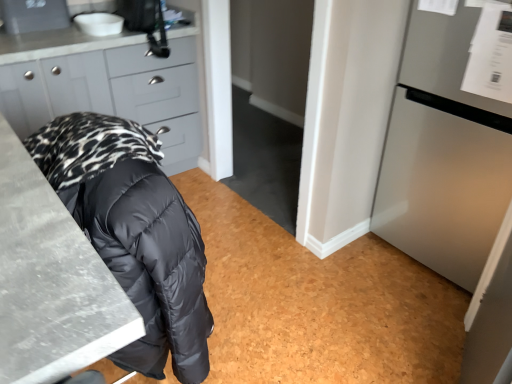
In order to face matte gray cabinets at upper left, should I rotate leftwards or rightwards?

To align with it, rotate left about 20.177°.

At what (x,y) coordinates should I click in order to perform the action: click on white glossy sink at upper left. Please return your answer as a coordinate pair (x, y). Image resolution: width=512 pixels, height=384 pixels. Looking at the image, I should click on (99, 23).

Image resolution: width=512 pixels, height=384 pixels. What do you see at coordinates (99, 23) in the screenshot?
I see `white glossy sink at upper left` at bounding box center [99, 23].

Identify the location of matte gray cabinets at upper left. (112, 93).

Could you tell me if white glossy sink at upper left is turned towards satin silver refrigerator at right?

No, white glossy sink at upper left is not turned towards satin silver refrigerator at right.

In the scene shown: Is the surface of white glossy sink at upper left in direct contact with satin silver refrigerator at right?

No, white glossy sink at upper left is not next to satin silver refrigerator at right.

Which is correct: white glossy sink at upper left is inside satin silver refrigerator at right, or outside of it?

white glossy sink at upper left is not inside satin silver refrigerator at right, it's outside.

Which object is positioned more to the right, white glossy sink at upper left or marble gray countertop at lower left?

Positioned to the right is marble gray countertop at lower left.

Which of these two, white glossy sink at upper left or marble gray countertop at lower left, stands taller?

marble gray countertop at lower left is taller.

Is point (86, 26) closer to camera compared to point (6, 371)?

That is False.

The width and height of the screenshot is (512, 384). I want to click on countertop lying on the right of white glossy sink at upper left, so click(51, 281).

Who is smaller, satin silver refrigerator at right or matte gray cabinets at upper left?

With smaller size is satin silver refrigerator at right.

Is satin silver refrigerator at right surrounding matte gray cabinets at upper left?

No, satin silver refrigerator at right does not contain matte gray cabinets at upper left.

Is satin silver refrigerator at right facing away from matte gray cabinets at upper left?

No.

Does satin silver refrigerator at right have a lesser height compared to matte gray cabinets at upper left?

No.

Is white glossy sink at upper left looking in the opposite direction of matte gray cabinets at upper left?

No, white glossy sink at upper left's orientation is not away from matte gray cabinets at upper left.

In the image, is white glossy sink at upper left positioned in front of or behind matte gray cabinets at upper left?

white glossy sink at upper left is positioned farther from the viewer than matte gray cabinets at upper left.

Based on their positions, is white glossy sink at upper left located to the left or right of matte gray cabinets at upper left?

white glossy sink at upper left is positioned on matte gray cabinets at upper left's right side.

Is point (180, 135) closer or farther from the camera than point (42, 283)?

Point (180, 135) is farther from the camera than point (42, 283).

Considering the relative sizes of matte gray cabinets at upper left and marble gray countertop at lower left in the image provided, is matte gray cabinets at upper left taller than marble gray countertop at lower left?

No, matte gray cabinets at upper left is not taller than marble gray countertop at lower left.

What's the angular difference between matte gray cabinets at upper left and marble gray countertop at lower left's facing directions?

There is a 88.6-degree angle between the facing directions of matte gray cabinets at upper left and marble gray countertop at lower left.

Considering the sizes of objects matte gray cabinets at upper left and marble gray countertop at lower left in the image provided, who is smaller, matte gray cabinets at upper left or marble gray countertop at lower left?

marble gray countertop at lower left is smaller.

In the image, is satin silver refrigerator at right positioned in front of or behind marble gray countertop at lower left?

Clearly, satin silver refrigerator at right is behind marble gray countertop at lower left.

Is satin silver refrigerator at right positioned far away from marble gray countertop at lower left?

satin silver refrigerator at right is far away from marble gray countertop at lower left.

Considering the positions of objects satin silver refrigerator at right and marble gray countertop at lower left in the image provided, who is more to the right, satin silver refrigerator at right or marble gray countertop at lower left?

satin silver refrigerator at right is more to the right.

From a real-world perspective, is satin silver refrigerator at right positioned above or below marble gray countertop at lower left?

satin silver refrigerator at right is above marble gray countertop at lower left.

From a real-world perspective, which is physically below, matte gray cabinets at upper left or white glossy sink at upper left?

matte gray cabinets at upper left is physically lower.

Is matte gray cabinets at upper left looking in the opposite direction of white glossy sink at upper left?

matte gray cabinets at upper left is not turned away from white glossy sink at upper left.

Consider the image. Considering the relative sizes of matte gray cabinets at upper left and white glossy sink at upper left in the image provided, is matte gray cabinets at upper left thinner than white glossy sink at upper left?

In fact, matte gray cabinets at upper left might be wider than white glossy sink at upper left.

Does matte gray cabinets at upper left appear on the left side of white glossy sink at upper left?

Yes.

I want to click on sink above the satin silver refrigerator at right (from a real-world perspective), so click(99, 23).

The image size is (512, 384). Find the location of `sink on the left of marble gray countertop at lower left`. sink on the left of marble gray countertop at lower left is located at coordinates (99, 23).

Which object lies nearer to the anchor point matte gray cabinets at upper left, satin silver refrigerator at right or marble gray countertop at lower left?

marble gray countertop at lower left.

From the image, which object appears to be nearer to satin silver refrigerator at right, marble gray countertop at lower left or matte gray cabinets at upper left?

The object closer to satin silver refrigerator at right is matte gray cabinets at upper left.

Considering their positions, is marble gray countertop at lower left positioned closer to matte gray cabinets at upper left than satin silver refrigerator at right?

marble gray countertop at lower left.

Looking at the image, which one is located closer to marble gray countertop at lower left, white glossy sink at upper left or satin silver refrigerator at right?

satin silver refrigerator at right lies closer to marble gray countertop at lower left than the other object.

Based on their spatial positions, is marble gray countertop at lower left or satin silver refrigerator at right further from white glossy sink at upper left?

The object further to white glossy sink at upper left is satin silver refrigerator at right.

Consider the image. When comparing their distances from matte gray cabinets at upper left, does marble gray countertop at lower left or white glossy sink at upper left seem closer?

white glossy sink at upper left is closer to matte gray cabinets at upper left.

From the image, which object appears to be farther from marble gray countertop at lower left, white glossy sink at upper left or matte gray cabinets at upper left?

white glossy sink at upper left lies further to marble gray countertop at lower left than the other object.

Estimate the real-world distances between objects in this image. Which object is further from marble gray countertop at lower left, matte gray cabinets at upper left or white glossy sink at upper left?

Based on the image, white glossy sink at upper left appears to be further to marble gray countertop at lower left.

Find the location of a particular element. The image size is (512, 384). sink located between matte gray cabinets at upper left and satin silver refrigerator at right in the left-right direction is located at coordinates (99, 23).

Find the location of a particular element. countertop between matte gray cabinets at upper left and satin silver refrigerator at right in the horizontal direction is located at coordinates pyautogui.click(x=51, y=281).

Find the location of `countertop between white glossy sink at upper left and satin silver refrigerator at right`. countertop between white glossy sink at upper left and satin silver refrigerator at right is located at coordinates (51, 281).

Locate an element on the screen. cabinetry located between marble gray countertop at lower left and white glossy sink at upper left in the depth direction is located at coordinates (112, 93).